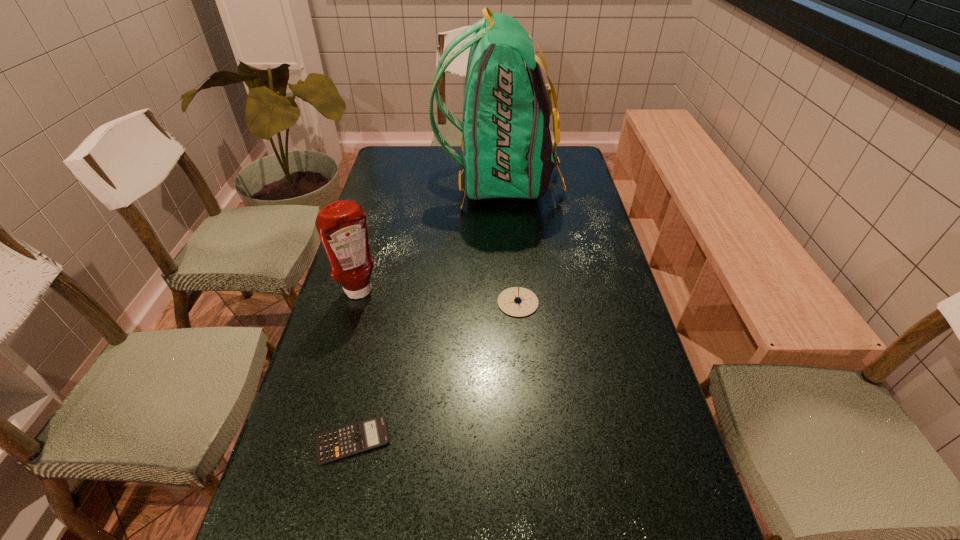
Locate an element on the screen. free spot between the condiment and the third tallest object is located at coordinates (439, 297).

Locate an element on the screen. This screenshot has height=540, width=960. free space that is in between the farthest object and the condiment is located at coordinates (430, 237).

Locate an element on the screen. The height and width of the screenshot is (540, 960). vacant space in between the nearest object and the third shortest object is located at coordinates (356, 366).

Where is `vacant space in between the second tallest object and the tallest object`? The width and height of the screenshot is (960, 540). vacant space in between the second tallest object and the tallest object is located at coordinates (430, 237).

Identify the location of vacant space that's between the tallest object and the compass. (509, 242).

Find the location of a particular element. Image resolution: width=960 pixels, height=540 pixels. empty space that is in between the calculator and the condiment is located at coordinates (356, 366).

I want to click on empty space that is in between the backpack and the condiment, so click(430, 237).

Where is `vacant space that's between the condiment and the shortest object`? The image size is (960, 540). vacant space that's between the condiment and the shortest object is located at coordinates (356, 366).

At what (x,y) coordinates should I click in order to perform the action: click on free space between the second shortest object and the condiment. Please return your answer as a coordinate pair (x, y). This screenshot has height=540, width=960. Looking at the image, I should click on (x=439, y=297).

The height and width of the screenshot is (540, 960). I want to click on free space between the condiment and the compass, so click(439, 297).